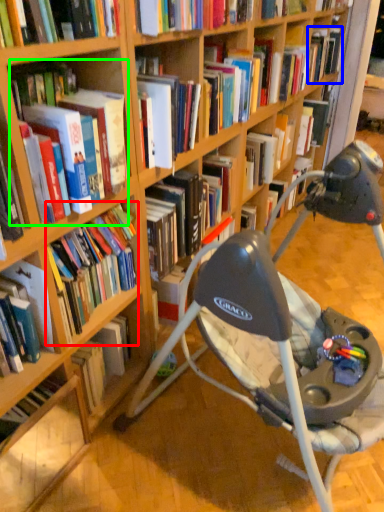
Question: Estimate the real-world distances between objects in this image. Which object is farther from book (highlighted by a red box), book (highlighted by a blue box) or book (highlighted by a green box)?

Choices:
 (A) book
 (B) book

Answer: (A)